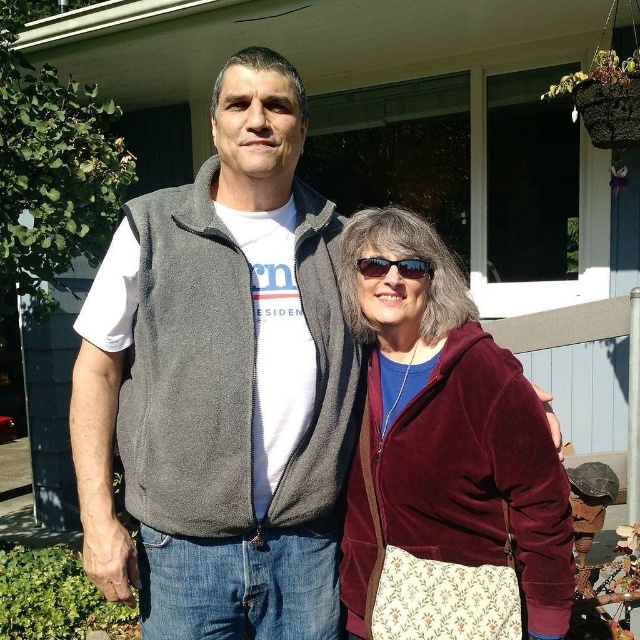
You are standing in front of the house and notice the velvet maroon jacket at center. Can you determine its exact position using the coordinate system provided?

The velvet maroon jacket at center is located at point [452,420] according to the coordinate system provided.

You are a photographer setting up a shoot in front of the house. You notice the velvet maroon jacket at center and the matte black sunglasses at center. Which object should you adjust first if you want to ensure both items are visible in the frame?

The velvet maroon jacket at center is below matte black sunglasses at center, so you should adjust the matte black sunglasses at center first to ensure it doesn not block the jacket.

You are organizing a charity event and need to display two items from the image on a stand. The stand has a height limit of 1.2 meters. Given that the gray fleece vest at center is much taller than the velvet maroon jacket at center, will both items fit on the stand if placed side by side vertically?

The gray fleece vest at center is much taller than the velvet maroon jacket at center. However, since the stand has a height limit of 1.2 meters and we don not have exact measurements, it is possible that the taller gray fleece vest at center alone might exceed the height limit. Therefore, both items may not fit on the stand if placed side by side vertically.